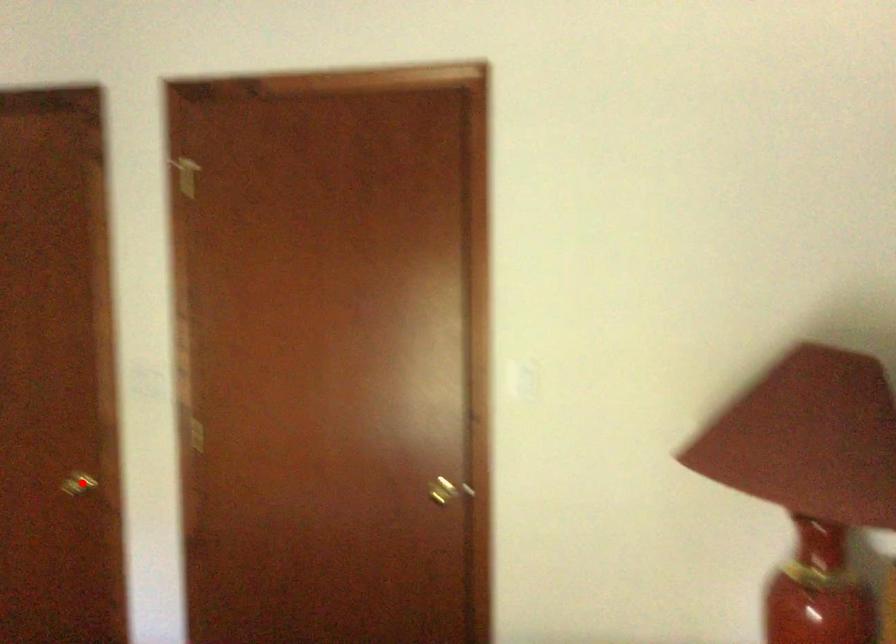
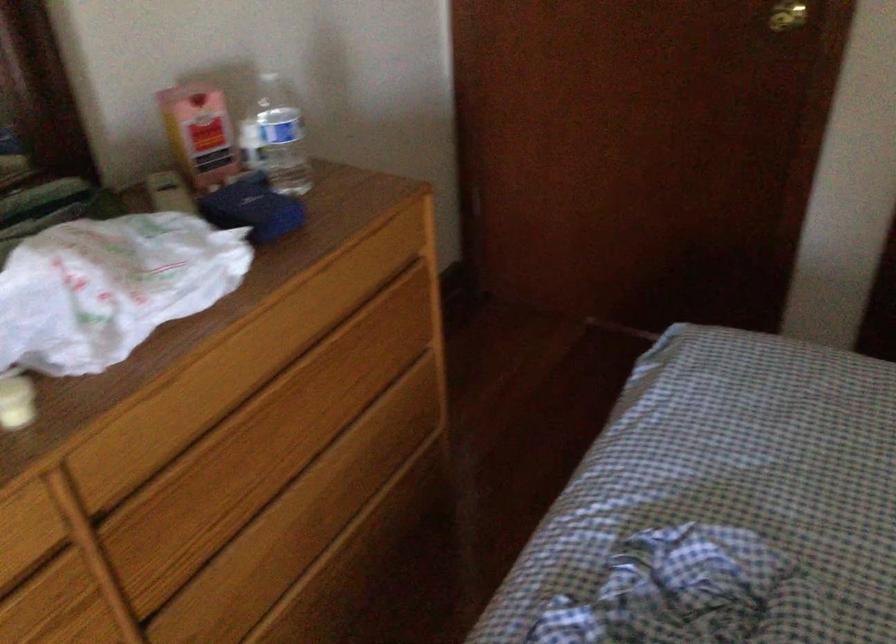
Locate, in the second image, the point that corresponds to the highlighted location in the first image.

(787, 15)